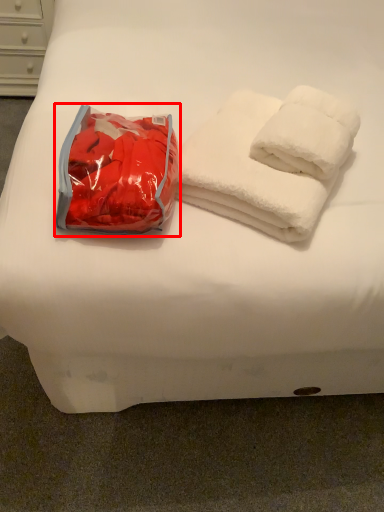
Question: From the image's perspective, what is the correct spatial positioning of bean bag chair (annotated by the red box) in reference to towel?

Choices:
 (A) below
 (B) above

Answer: (A)